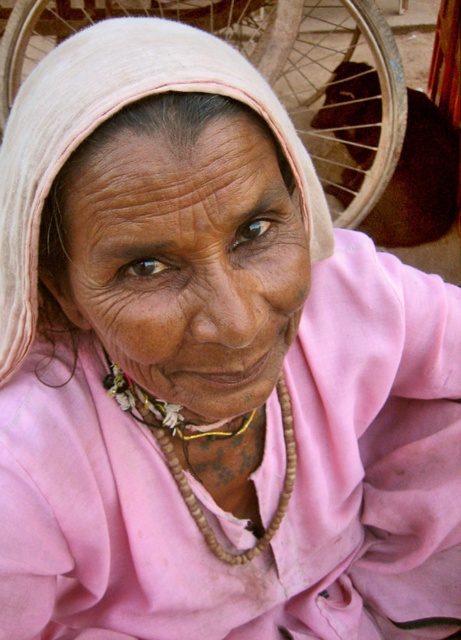
You are an artist trying to sketch this person. You notice the brown matte face at center and the wooden beads at center. Which object is wider?

The brown matte face at center is wider than the wooden beads at center.

You are a photographer adjusting the focus on your camera. You want to ensure both the brown matte face at center and the wooden beads at center are in focus. Given their sizes, which object should you prioritize focusing on first?

The brown matte face at center has a larger size compared to wooden beads at center, so you should prioritize focusing on the brown matte face at center first to ensure clarity.

You are an artist sketching this person and want to add depth to your drawing. You have two points on the person, point (266,269) and point (287,496). Which point should you shade more to create the illusion of depth?

You should shade point (287,496) more to create the illusion of depth because it is further away from the viewer compared to point (266,269).